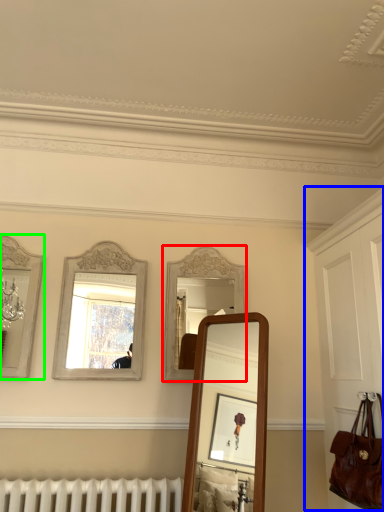
Question: Which object is the closest to the mirror (highlighted by a red box)? Choose among these: dresser (highlighted by a blue box) or mirror (highlighted by a green box).

Choices:
 (A) dresser
 (B) mirror

Answer: (A)